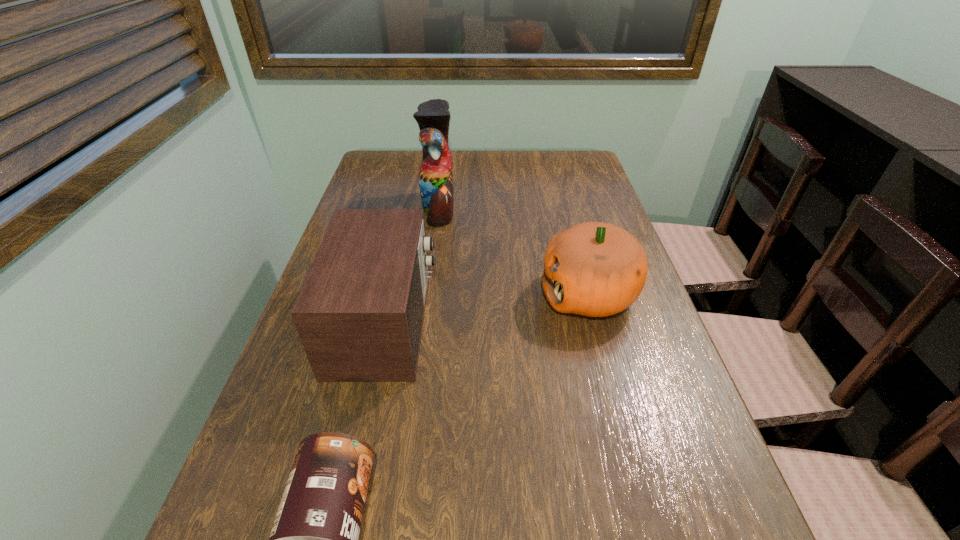
Find the location of `the farthest object`. the farthest object is located at coordinates (435, 177).

Image resolution: width=960 pixels, height=540 pixels. In order to click on the tallest object in this screenshot , I will do `click(435, 177)`.

Where is `radio receiver`? This screenshot has height=540, width=960. radio receiver is located at coordinates (359, 314).

I want to click on the rightmost object, so click(596, 269).

At what (x,y) coordinates should I click in order to perform the action: click on free space located 0.240m at the face of the farthest object. Please return your answer as a coordinate pair (x, y). The height and width of the screenshot is (540, 960). Looking at the image, I should click on (538, 208).

The height and width of the screenshot is (540, 960). I want to click on free spot located on the front-facing side of the radio receiver, so click(513, 322).

Find the location of a particular element. The image size is (960, 540). vacant space positioned 0.230m on the face of the pumpkin is located at coordinates (440, 295).

Where is `vacant area located on the face of the pumpkin`? Image resolution: width=960 pixels, height=540 pixels. vacant area located on the face of the pumpkin is located at coordinates (431, 295).

You are a GUI agent. You are given a task and a screenshot of the screen. Output one action in this format:
    pyautogui.click(x=<x>, y=<y>)
    Task: Click on the free point located 0.310m on the face of the pumpkin
    The image size is (960, 540).
    Given the screenshot: What is the action you would take?
    pyautogui.click(x=404, y=295)

Identify the location of object that is at the left edge. (359, 314).